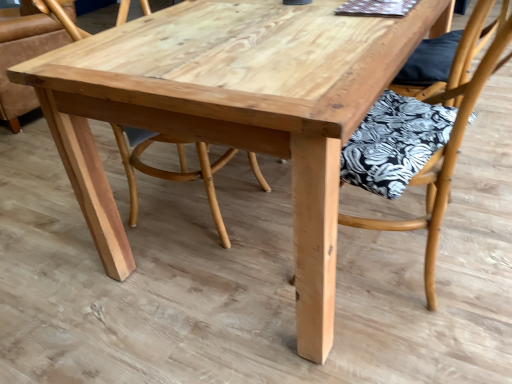
Locate an element on the screen. wooden chair with floral cushion at center, placed as the second chair when sorted from left to right is located at coordinates (442, 164).

Describe the element at coordinates (442, 164) in the screenshot. The width and height of the screenshot is (512, 384). I see `wooden chair with floral cushion at center, which ranks as the 2th chair in back-to-front order` at that location.

This screenshot has height=384, width=512. Identify the location of natural wood chair at center, which ranks as the first chair in back-to-front order. [25, 56].

The height and width of the screenshot is (384, 512). Describe the element at coordinates (25, 56) in the screenshot. I see `natural wood chair at center, positioned as the first chair in left-to-right order` at that location.

What are the coordinates of `wooden chair with floral cushion at center, which ranks as the 2th chair in back-to-front order` in the screenshot? It's located at (442, 164).

Based on their positions, is natural wood chair at center, which appears as the 2th chair when viewed from the right, located to the left or right of wooden chair with floral cushion at center, which ranks as the 1th chair in right-to-left order?

Clearly, natural wood chair at center, which appears as the 2th chair when viewed from the right, is on the left of wooden chair with floral cushion at center, which ranks as the 1th chair in right-to-left order, in the image.

Considering the positions of objects natural wood chair at center, which appears as the 2th chair when viewed from the right, and wooden chair with floral cushion at center, which ranks as the 1th chair in right-to-left order, in the image provided, who is in front, natural wood chair at center, which appears as the 2th chair when viewed from the right, or wooden chair with floral cushion at center, which ranks as the 1th chair in right-to-left order,?

wooden chair with floral cushion at center, which ranks as the 1th chair in right-to-left order, is closer to the camera.

Is point (50, 42) closer to viewer compared to point (435, 164)?

No, it is not.

From the image's perspective, is natural wood chair at center, which appears as the 2th chair when viewed from the right, located above or below wooden chair with floral cushion at center, which ranks as the 2th chair in back-to-front order?

natural wood chair at center, which appears as the 2th chair when viewed from the right, is above wooden chair with floral cushion at center, which ranks as the 2th chair in back-to-front order.

From a real-world perspective, is natural wood chair at center, positioned as the first chair in left-to-right order, over wooden chair with floral cushion at center, which ranks as the 1th chair in right-to-left order?

Incorrect, from a real-world perspective, natural wood chair at center, positioned as the first chair in left-to-right order, is lower than wooden chair with floral cushion at center, which ranks as the 1th chair in right-to-left order.

Considering the sizes of objects natural wood chair at center, which ranks as the first chair in back-to-front order, and wooden chair with floral cushion at center, which ranks as the 1th chair in right-to-left order, in the image provided, who is thinner, natural wood chair at center, which ranks as the first chair in back-to-front order, or wooden chair with floral cushion at center, which ranks as the 1th chair in right-to-left order,?

Thinner between the two is wooden chair with floral cushion at center, which ranks as the 1th chair in right-to-left order.

Considering the relative sizes of natural wood chair at center, which is counted as the 2th chair, starting from the front, and wooden chair with floral cushion at center, which ranks as the 2th chair in back-to-front order, in the image provided, is natural wood chair at center, which is counted as the 2th chair, starting from the front, taller than wooden chair with floral cushion at center, which ranks as the 2th chair in back-to-front order,?

No.

Based on their sizes in the image, would you say natural wood chair at center, which appears as the 2th chair when viewed from the right, is bigger or smaller than wooden chair with floral cushion at center, the 1th chair from the front?

Clearly, natural wood chair at center, which appears as the 2th chair when viewed from the right, is larger in size than wooden chair with floral cushion at center, the 1th chair from the front.

Does natural wood chair at center, which is counted as the 2th chair, starting from the front, contain wooden chair with floral cushion at center, which ranks as the 1th chair in right-to-left order?

No, wooden chair with floral cushion at center, which ranks as the 1th chair in right-to-left order, is not a part of natural wood chair at center, which is counted as the 2th chair, starting from the front.

Is natural wood chair at center, positioned as the first chair in left-to-right order, not near wooden chair with floral cushion at center, the 1th chair from the front?

natural wood chair at center, positioned as the first chair in left-to-right order, is far away from wooden chair with floral cushion at center, the 1th chair from the front.

Is natural wood chair at center, which is counted as the 2th chair, starting from the front, turned away from wooden chair with floral cushion at center, which ranks as the 1th chair in right-to-left order?

No, natural wood chair at center, which is counted as the 2th chair, starting from the front,'s orientation is not away from wooden chair with floral cushion at center, which ranks as the 1th chair in right-to-left order.

How different are the orientations of natural wood chair at center, which ranks as the first chair in back-to-front order, and wooden chair with floral cushion at center, which ranks as the 2th chair in back-to-front order, in degrees?

They differ by 74.2 degrees in their facing directions.

Based on the photo, measure the distance between natural wood chair at center, which is counted as the 2th chair, starting from the front, and wooden chair with floral cushion at center, placed as the second chair when sorted from left to right.

6.95 feet.

I want to click on chair above the wooden chair with floral cushion at center, placed as the second chair when sorted from left to right (from the image's perspective), so click(25, 56).

Is wooden chair with floral cushion at center, placed as the second chair when sorted from left to right, at the left side of natural wood chair at center, which ranks as the first chair in back-to-front order?

No, wooden chair with floral cushion at center, placed as the second chair when sorted from left to right, is not to the left of natural wood chair at center, which ranks as the first chair in back-to-front order.

Which object is closer to the camera, wooden chair with floral cushion at center, the 1th chair from the front, or natural wood chair at center, which is counted as the 2th chair, starting from the front?

wooden chair with floral cushion at center, the 1th chair from the front, is more forward.

Which point is more forward, (432,247) or (35,34)?

Positioned in front is point (432,247).

From the image's perspective, is wooden chair with floral cushion at center, the 1th chair from the front, beneath natural wood chair at center, which ranks as the first chair in back-to-front order?

Correct, wooden chair with floral cushion at center, the 1th chair from the front, appears lower than natural wood chair at center, which ranks as the first chair in back-to-front order, in the image.

From a real-world perspective, is wooden chair with floral cushion at center, placed as the second chair when sorted from left to right, located beneath natural wood chair at center, which appears as the 2th chair when viewed from the right?

No, from a real-world perspective, wooden chair with floral cushion at center, placed as the second chair when sorted from left to right, is not under natural wood chair at center, which appears as the 2th chair when viewed from the right.

Does wooden chair with floral cushion at center, which ranks as the 2th chair in back-to-front order, have a lesser width compared to natural wood chair at center, positioned as the first chair in left-to-right order?

Yes.

Between wooden chair with floral cushion at center, which ranks as the 2th chair in back-to-front order, and natural wood chair at center, which ranks as the first chair in back-to-front order, which one has less height?

With less height is natural wood chair at center, which ranks as the first chair in back-to-front order.

Consider the image. Is wooden chair with floral cushion at center, which ranks as the 1th chair in right-to-left order, bigger or smaller than natural wood chair at center, which ranks as the first chair in back-to-front order?

In the image, wooden chair with floral cushion at center, which ranks as the 1th chair in right-to-left order, appears to be smaller than natural wood chair at center, which ranks as the first chair in back-to-front order.

Is wooden chair with floral cushion at center, placed as the second chair when sorted from left to right, inside or outside of natural wood chair at center, which is counted as the 2th chair, starting from the front?

The correct answer is: outside.

In the scene shown: Is wooden chair with floral cushion at center, the 1th chair from the front, directly adjacent to natural wood chair at center, which ranks as the first chair in back-to-front order?

No, wooden chair with floral cushion at center, the 1th chair from the front, is not next to natural wood chair at center, which ranks as the first chair in back-to-front order.

Is wooden chair with floral cushion at center, the 1th chair from the front, facing away from natural wood chair at center, positioned as the first chair in left-to-right order?

No.

How many degrees apart are the facing directions of wooden chair with floral cushion at center, the 1th chair from the front, and natural wood chair at center, which is counted as the 2th chair, starting from the front?

74.2 degrees.

Identify the location of chair located below the natural wood chair at center, positioned as the first chair in left-to-right order (from the image's perspective). The width and height of the screenshot is (512, 384). (442, 164).

Where is `chair below the wooden chair with floral cushion at center, which ranks as the 2th chair in back-to-front order (from a real-world perspective)`? The height and width of the screenshot is (384, 512). chair below the wooden chair with floral cushion at center, which ranks as the 2th chair in back-to-front order (from a real-world perspective) is located at coordinates (25, 56).

Locate an element on the screen. This screenshot has width=512, height=384. chair located on the left of wooden chair with floral cushion at center, which ranks as the 1th chair in right-to-left order is located at coordinates (25, 56).